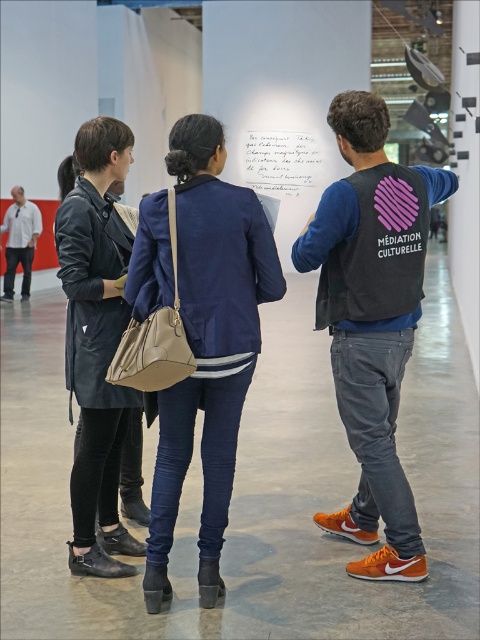
Which is in front, point (402, 289) or point (37, 214)?

Point (402, 289) is more forward.

You are a GUI agent. You are given a task and a screenshot of the screen. Output one action in this format:
    pyautogui.click(x=<x>, y=<y>)
    Task: Click on the black fabric vest at center
    
    Given the screenshot: What is the action you would take?
    pyautogui.click(x=372, y=320)

Is navy blue fabric jacket at center to the left of white shirt at left from the viewer's perspective?

No, navy blue fabric jacket at center is not to the left of white shirt at left.

Who is higher up, navy blue fabric jacket at center or white shirt at left?

white shirt at left

Which is behind, point (167, 563) or point (12, 273)?

The point (12, 273) is more distant.

The image size is (480, 640). What are the coordinates of `navy blue fabric jacket at center` in the screenshot? It's located at coord(208,346).

From the picture: Who is taller, navy blue fabric jacket at center or white paper at center?

Standing taller between the two is navy blue fabric jacket at center.

Is point (157, 586) less distant than point (305, 140)?

Yes.

I want to click on navy blue fabric jacket at center, so click(208, 346).